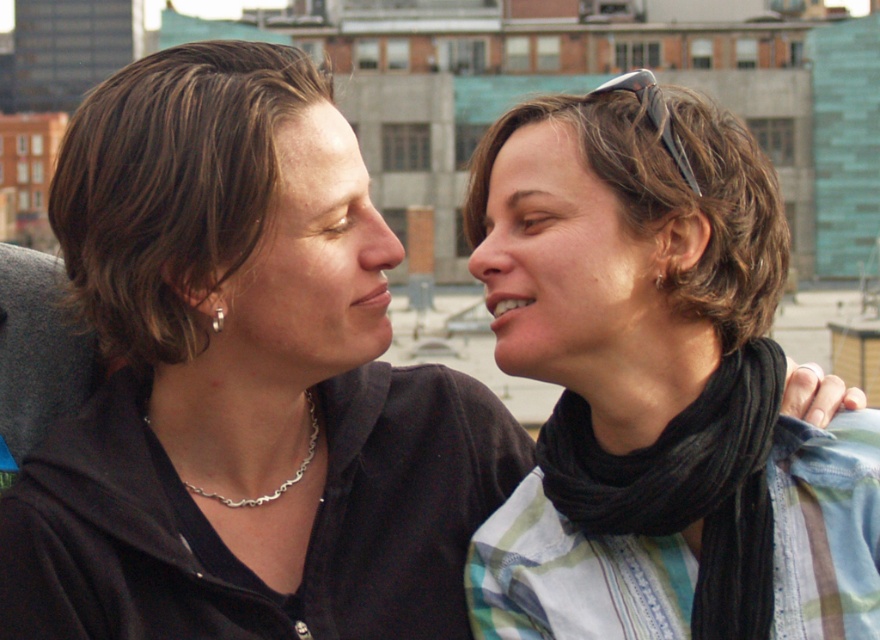
Can you confirm if dark brown hair at center is taller than brown matte hair at upper right?

No, dark brown hair at center is not taller than brown matte hair at upper right.

Is dark brown hair at center wider than brown matte hair at upper right?

Incorrect, dark brown hair at center's width does not surpass brown matte hair at upper right's.

Is point (187, 141) positioned after point (731, 339)?

No, (187, 141) is in front of (731, 339).

Locate an element on the screen. The width and height of the screenshot is (880, 640). dark brown hair at center is located at coordinates (171, 186).

Is dark brown hair at center to the left of silver chain necklace at center from the viewer's perspective?

Yes, dark brown hair at center is to the left of silver chain necklace at center.

Who is more distant from viewer, (x=199, y=161) or (x=253, y=497)?

Positioned behind is point (x=253, y=497).

Who is more distant from viewer, (86, 212) or (150, 433)?

Point (150, 433)

This screenshot has height=640, width=880. I want to click on dark brown hair at center, so click(171, 186).

Can you confirm if black scarf at upper right is smaller than silver chain necklace at center?

Incorrect, black scarf at upper right is not smaller in size than silver chain necklace at center.

Can you confirm if black scarf at upper right is positioned to the left of silver chain necklace at center?

Incorrect, black scarf at upper right is not on the left side of silver chain necklace at center.

This screenshot has height=640, width=880. Describe the element at coordinates (657, 387) in the screenshot. I see `black scarf at upper right` at that location.

Locate an element on the screen. This screenshot has height=640, width=880. black scarf at upper right is located at coordinates (657, 387).